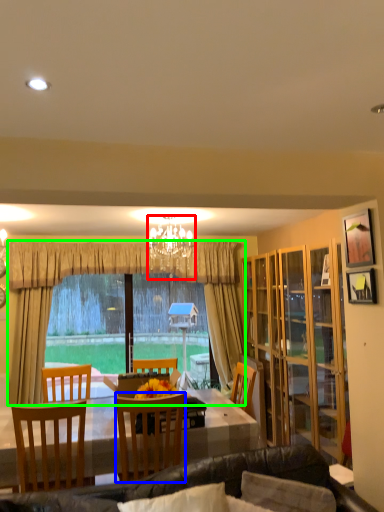
Question: Based on their relative distances, which object is farther from lamp (highlighted by a red box)? Choose from chair (highlighted by a blue box) and curtain (highlighted by a green box).

Choices:
 (A) chair
 (B) curtain

Answer: (A)